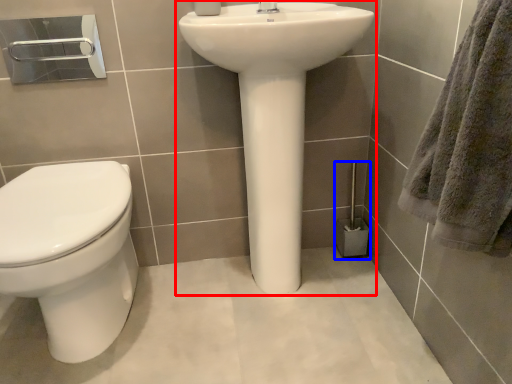
Question: Which object is closer to the camera taking this photo, sink (highlighted by a red box) or brush (highlighted by a blue box)?

Choices:
 (A) sink
 (B) brush

Answer: (A)